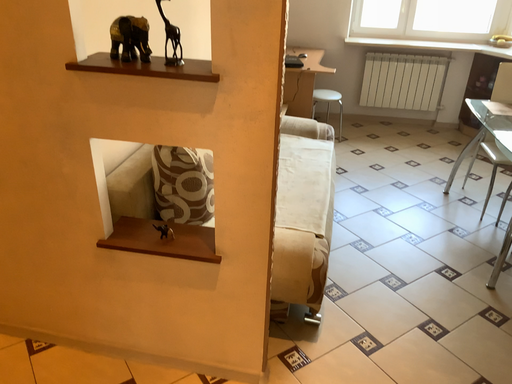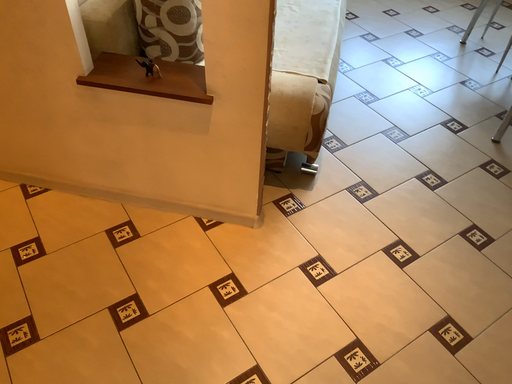
Question: Which way did the camera rotate in the video?

Choices:
 (A) rotated downward
 (B) rotated upward

Answer: (A)